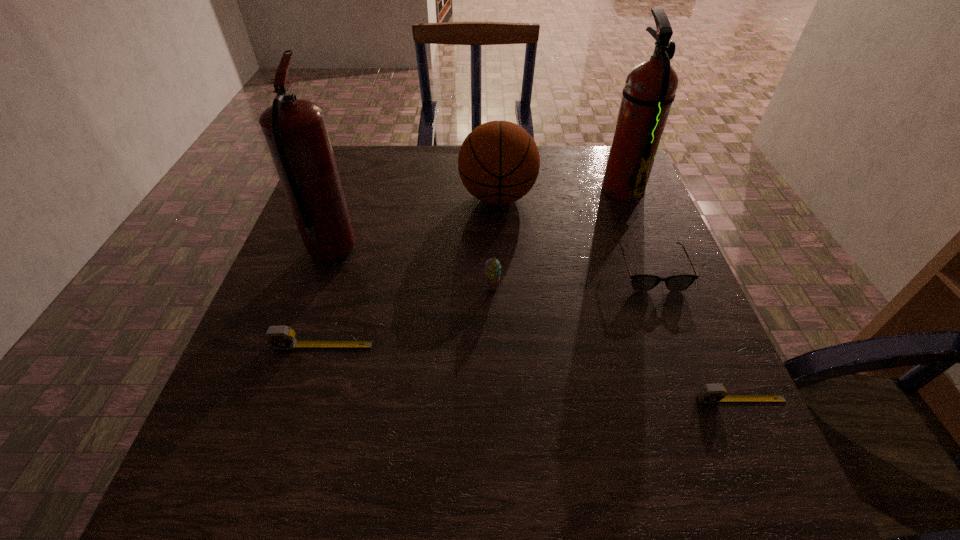
Where is `free space at the near edge of the desktop`? The width and height of the screenshot is (960, 540). free space at the near edge of the desktop is located at coordinates (643, 407).

Locate an element on the screen. This screenshot has height=540, width=960. free space at the left edge is located at coordinates (228, 388).

Image resolution: width=960 pixels, height=540 pixels. I want to click on free space at the right edge of the desktop, so click(617, 294).

The height and width of the screenshot is (540, 960). In order to click on free spot at the near left corner of the desktop in this screenshot , I will do `click(225, 408)`.

Find the location of `free space between the nearer tape measure and the spectacles`. free space between the nearer tape measure and the spectacles is located at coordinates (696, 335).

Locate an element on the screen. The width and height of the screenshot is (960, 540). vacant space that's between the sixth farthest object and the fourth tallest object is located at coordinates (407, 317).

Find the location of a particular element. Image resolution: width=960 pixels, height=540 pixels. vacant area that lies between the farther fire extinguisher and the left tape measure is located at coordinates (472, 267).

This screenshot has height=540, width=960. Find the location of `unoccupied area between the spectacles and the fourth shortest object`. unoccupied area between the spectacles and the fourth shortest object is located at coordinates (571, 280).

The width and height of the screenshot is (960, 540). I want to click on empty space between the right fire extinguisher and the nearer fire extinguisher, so click(x=477, y=220).

Identify the location of empty space between the spectacles and the sherbert. (571, 280).